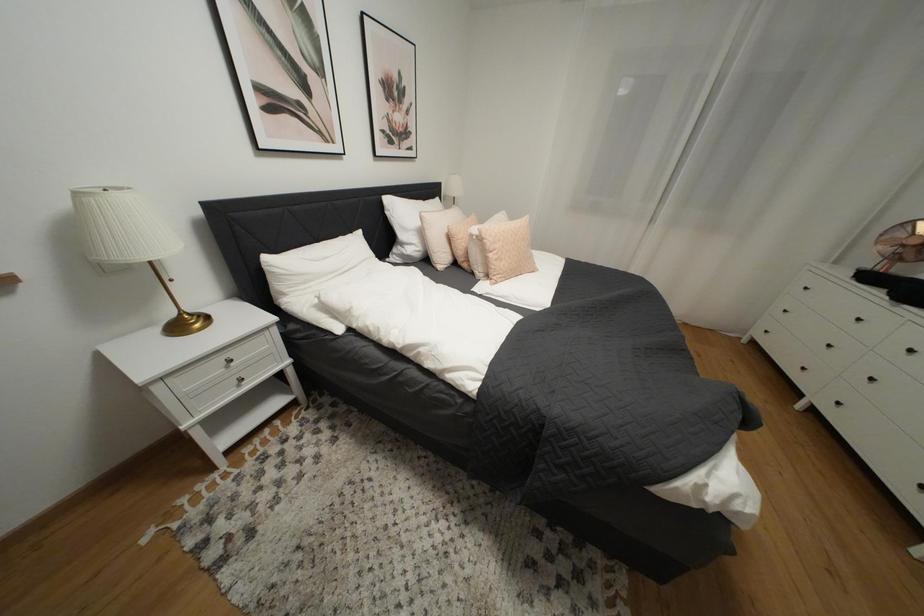
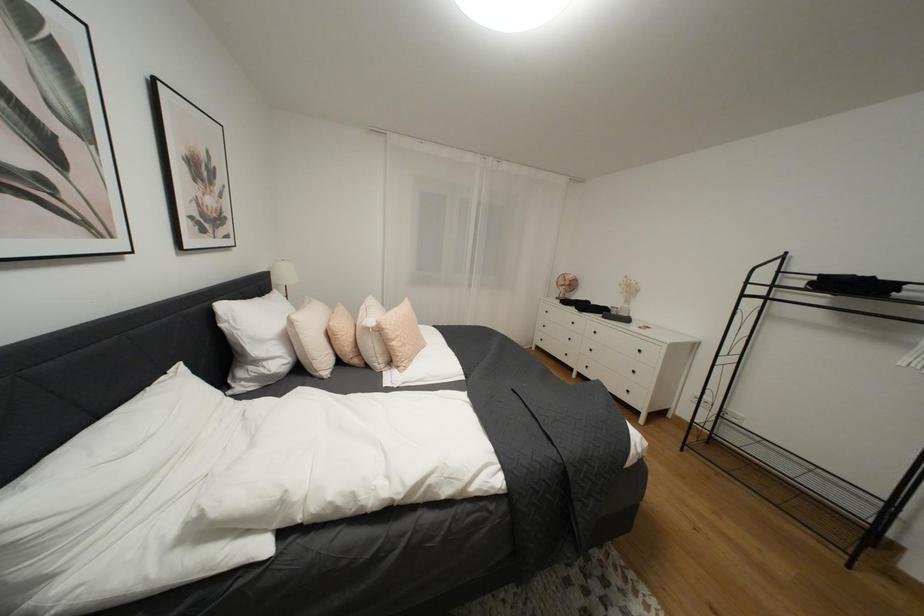
Question: The images are taken continuously from a first-person perspective. In which direction is your viewpoint rotating?

Choices:
 (A) Left
 (B) Right
 (C) Up
 (D) Down

Answer: (B)